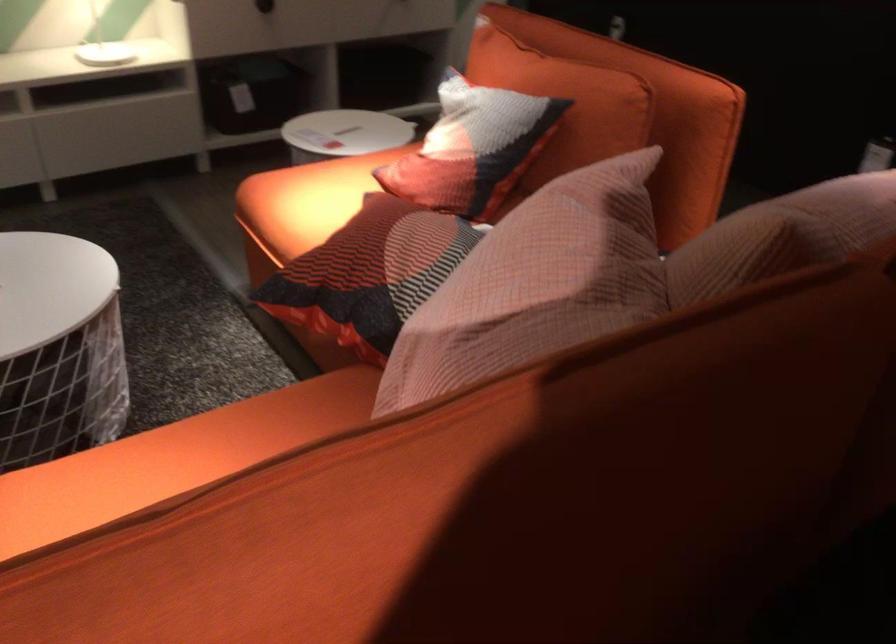
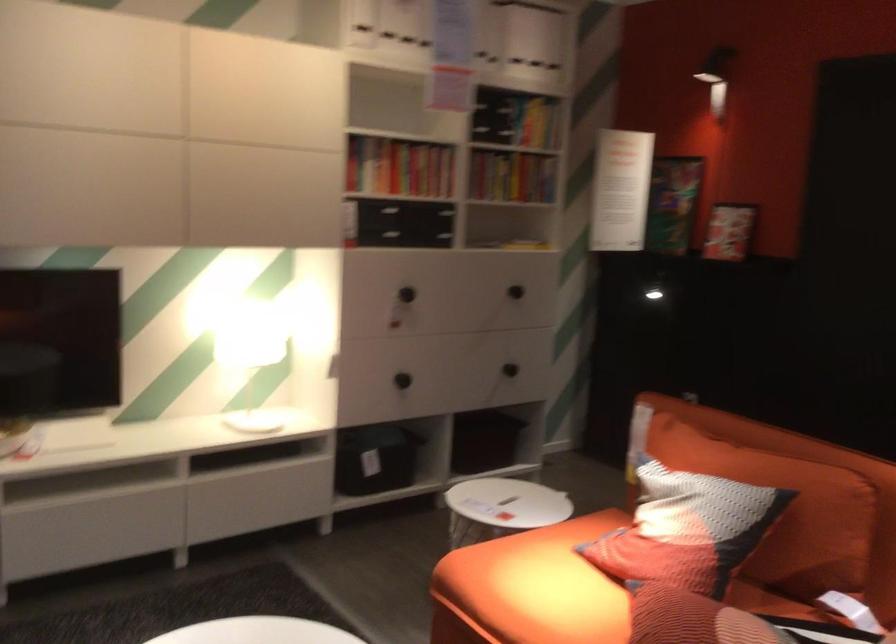
Question: The images are taken continuously from a first-person perspective. In which direction is your viewpoint rotating?

Choices:
 (A) Left
 (B) Right
 (C) Up
 (D) Down

Answer: (C)